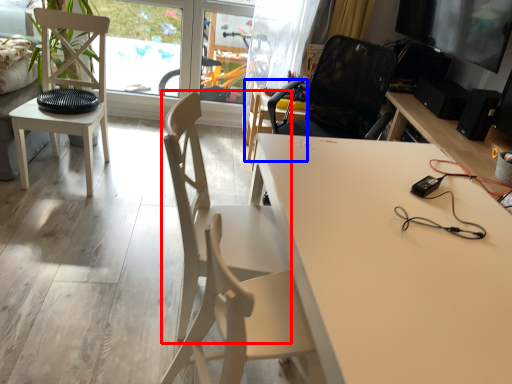
Question: Which point is closer to the camera, chair (highlighted by a red box) or chair (highlighted by a blue box)?

Choices:
 (A) chair
 (B) chair

Answer: (A)